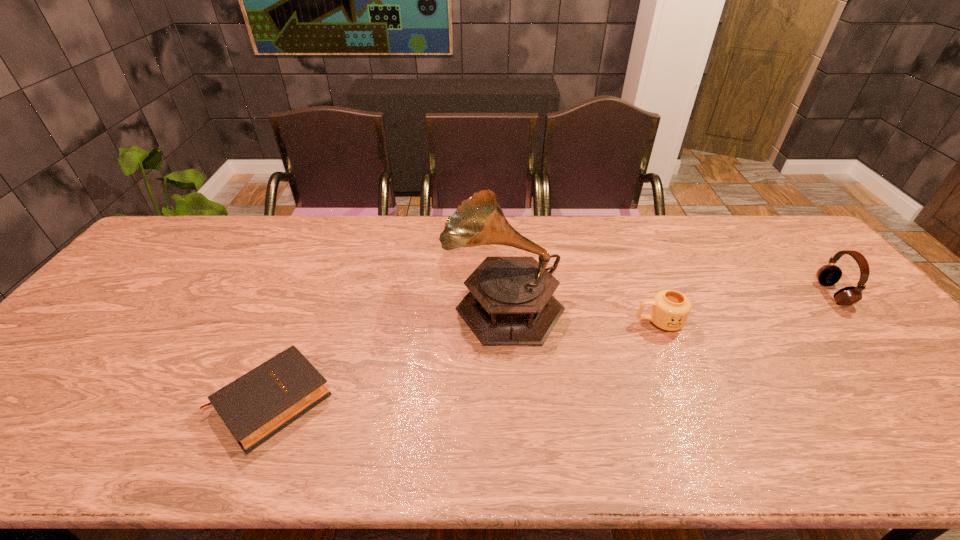
At what (x,y) coordinates should I click in order to perform the action: click on vacant space located on the horn direction of the phonograph record. Please return your answer as a coordinate pair (x, y). Image resolution: width=960 pixels, height=540 pixels. Looking at the image, I should click on (365, 303).

You are a GUI agent. You are given a task and a screenshot of the screen. Output one action in this format:
    pyautogui.click(x=<x>, y=<y>)
    Task: Click on the vacant region located 0.170m on the ear pads of the rightmost object
    The width and height of the screenshot is (960, 540).
    Given the screenshot: What is the action you would take?
    pyautogui.click(x=763, y=293)

Locate an element on the screen. The height and width of the screenshot is (540, 960). vacant area situated on the ear pads of the rightmost object is located at coordinates (783, 293).

Locate an element on the screen. Image resolution: width=960 pixels, height=540 pixels. free space located on the ear pads of the rightmost object is located at coordinates (746, 293).

Locate an element on the screen. This screenshot has width=960, height=540. vacant space located on the handle side of the second object from right to left is located at coordinates (492, 322).

Find the location of a particular element. free spot located 0.230m on the handle side of the second object from right to left is located at coordinates (550, 322).

The width and height of the screenshot is (960, 540). I want to click on vacant region located 0.170m on the handle side of the second object from right to left, so [572, 322].

Locate an element on the screen. The width and height of the screenshot is (960, 540). free space located 0.200m on the back of the shortest object is located at coordinates (312, 300).

Locate an element on the screen. This screenshot has height=540, width=960. object that is at the near edge is located at coordinates (254, 407).

This screenshot has height=540, width=960. Identify the location of object that is positioned at the right edge. (827, 275).